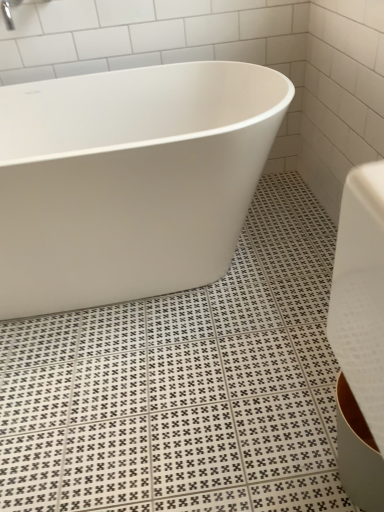
Question: From their relative heights in the image, would you say white glossy bathtub at center is taller or shorter than silver metallic faucet at upper left?

Choices:
 (A) short
 (B) tall

Answer: (B)

Question: Based on their positions, is white glossy bathtub at center located to the left or right of silver metallic faucet at upper left?

Choices:
 (A) right
 (B) left

Answer: (A)

Question: Do you think white glossy bathtub at center is within silver metallic faucet at upper left, or outside of it?

Choices:
 (A) inside
 (B) outside

Answer: (B)

Question: From a real-world perspective, relative to white glossy bathtub at center, is silver metallic faucet at upper left vertically above or below?

Choices:
 (A) above
 (B) below

Answer: (A)

Question: Which is correct: silver metallic faucet at upper left is inside white glossy bathtub at center, or outside of it?

Choices:
 (A) outside
 (B) inside

Answer: (A)

Question: In terms of height, does silver metallic faucet at upper left look taller or shorter compared to white glossy bathtub at center?

Choices:
 (A) short
 (B) tall

Answer: (A)

Question: From the image's perspective, is silver metallic faucet at upper left positioned above or below white glossy bathtub at center?

Choices:
 (A) above
 (B) below

Answer: (A)